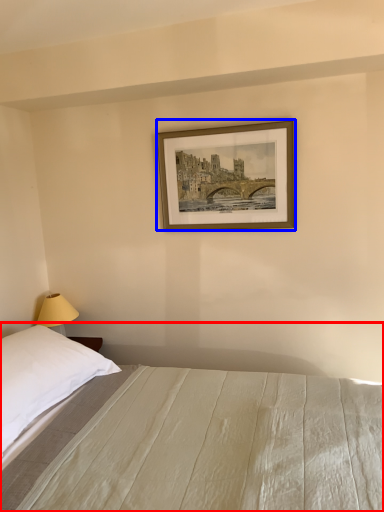
Question: Which of the following is the farthest to the observer, bed (highlighted by a red box) or picture frame (highlighted by a blue box)?

Choices:
 (A) bed
 (B) picture frame

Answer: (B)